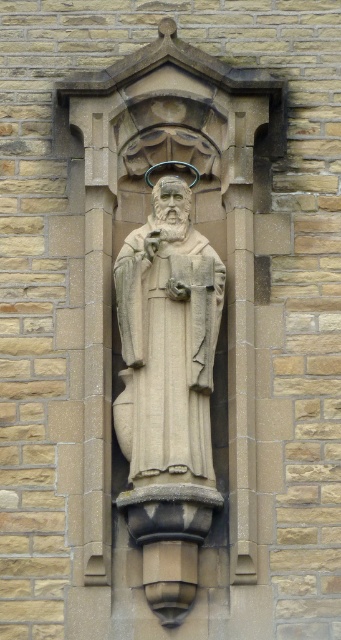
Question: Considering the relative positions of beige stone statue at center and smooth stone robe at center in the image provided, where is beige stone statue at center located with respect to smooth stone robe at center?

Choices:
 (A) right
 (B) left

Answer: (A)

Question: Which point is farther from the camera taking this photo?

Choices:
 (A) (169, 307)
 (B) (146, 632)

Answer: (A)

Question: Does beige stone statue at center appear on the left side of smooth stone robe at center?

Choices:
 (A) yes
 (B) no

Answer: (B)

Question: Which of the following is the farthest from the observer?

Choices:
 (A) (62, 100)
 (B) (174, 426)

Answer: (A)

Question: Is beige stone statue at center above smooth stone robe at center?

Choices:
 (A) no
 (B) yes

Answer: (B)